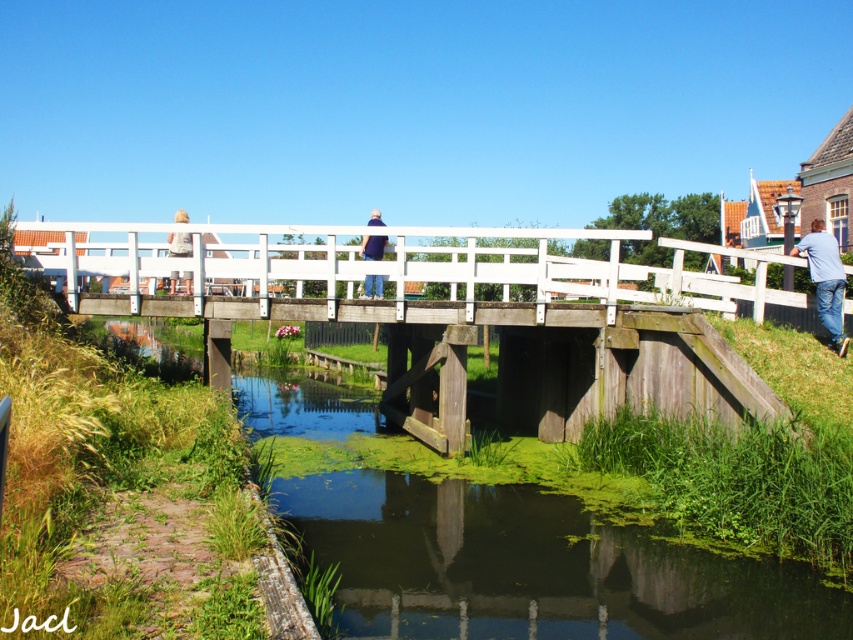
Question: Can you confirm if white wooden bridge at center is positioned to the right of blue jeans at right?

Choices:
 (A) no
 (B) yes

Answer: (A)

Question: Among these objects, which one is nearest to the camera?

Choices:
 (A) green algae-covered water at lower center
 (B) blue fabric shirt at center
 (C) white wooden bridge at center

Answer: (A)

Question: Estimate the real-world distances between objects in this image. Which object is farther from the green algae-covered water at lower center?

Choices:
 (A) blue fabric shirt at center
 (B) light brown wooden chair at upper center

Answer: (B)

Question: Can you confirm if white wooden bridge at center is wider than blue fabric shirt at center?

Choices:
 (A) no
 (B) yes

Answer: (B)

Question: Is green algae-covered water at lower center further to the viewer compared to blue fabric shirt at center?

Choices:
 (A) no
 (B) yes

Answer: (A)

Question: Which point is closer to the camera?

Choices:
 (A) white wooden bridge at center
 (B) blue fabric shirt at center
 (C) light brown wooden chair at upper center

Answer: (A)